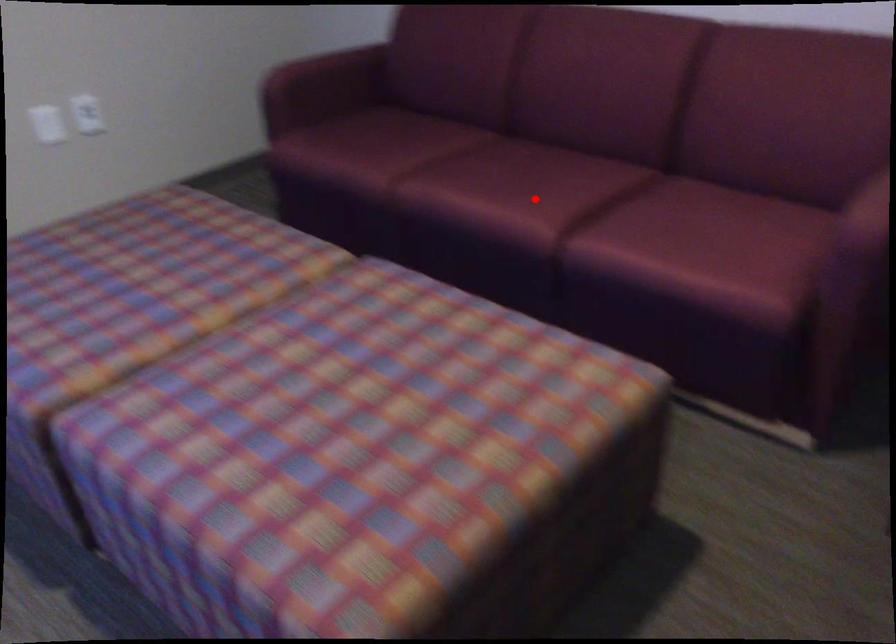
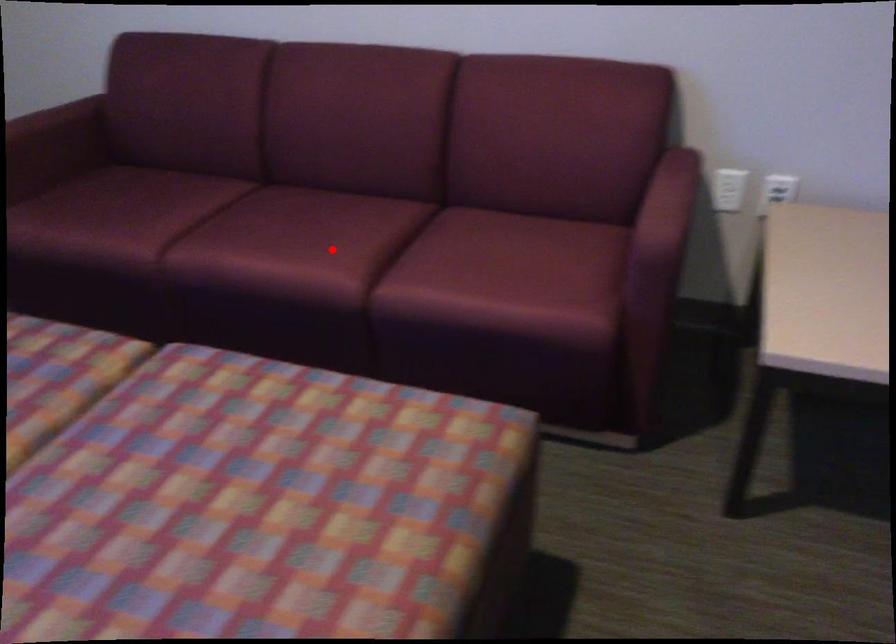
I am providing you with two images of the same scene from different viewpoints. A red point is marked on the first image and another point is marked on the second image. Does the point marked in image1 correspond to the same location as the one in image2?

Yes